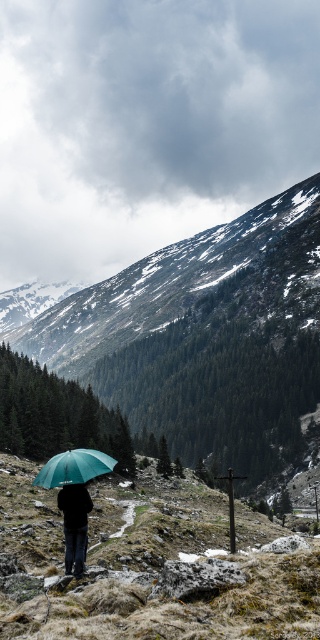
Question: Which point appears closest to the camera in this image?

Choices:
 (A) (102, 458)
 (B) (72, 550)
 (C) (245, 241)

Answer: (B)

Question: Is dark green umbrella at center thinner than green matte umbrella at lower left?

Choices:
 (A) yes
 (B) no

Answer: (A)

Question: Among these objects, which one is farthest from the camera?

Choices:
 (A) snowy rocky mountain at center
 (B) dark green umbrella at center
 (C) green matte umbrella at lower left

Answer: (A)

Question: Which object is positioned closest to the green matte umbrella at lower left?

Choices:
 (A) dark green umbrella at center
 (B) snowy rocky mountain at center

Answer: (A)

Question: Is dark green umbrella at center wider than green matte umbrella at lower left?

Choices:
 (A) yes
 (B) no

Answer: (B)

Question: Can you confirm if dark green umbrella at center is positioned above green matte umbrella at lower left?

Choices:
 (A) no
 (B) yes

Answer: (A)